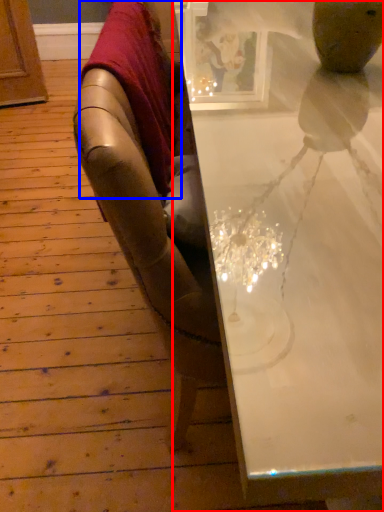
Question: Which object appears closest to the camera in this image, table (highlighted by a red box) or blanket (highlighted by a blue box)?

Choices:
 (A) table
 (B) blanket

Answer: (A)